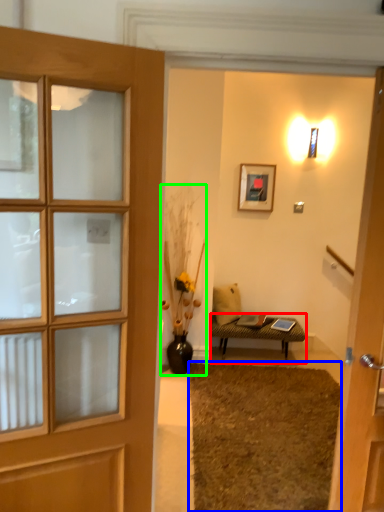
Question: Which object is positioned closest to table (highlighted by a red box)? Select from doormat (highlighted by a blue box) and houseplant (highlighted by a green box).

Choices:
 (A) doormat
 (B) houseplant

Answer: (B)